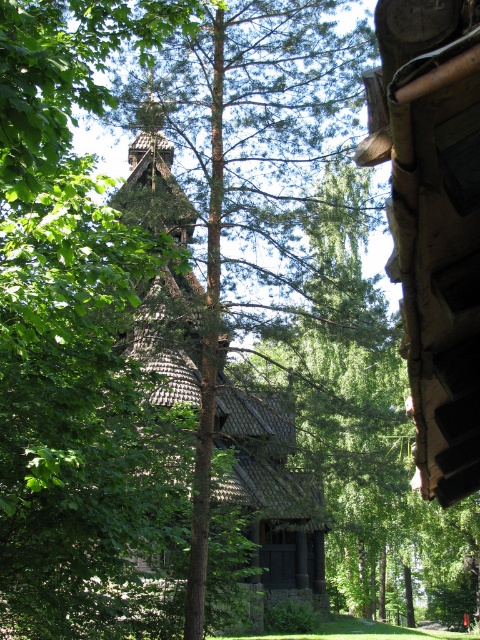
You are planning to build a new cabin in the forest. You have two options for the location based on the image. The first option is near the brown wooden hut at upper right, and the second option is near the brown wooden hut at center. Which location would allow you to have more space for your new cabin?

The brown wooden hut at upper right occupies less space than the brown wooden hut at center, so choosing the location near the brown wooden hut at upper right would provide more space for your new cabin.

You are standing in the forest and see both the brown wooden hut at upper right and the wooden spire at center. Which structure is closer to you?

The brown wooden hut at upper right is closer to you because it is in front of the wooden spire at center.